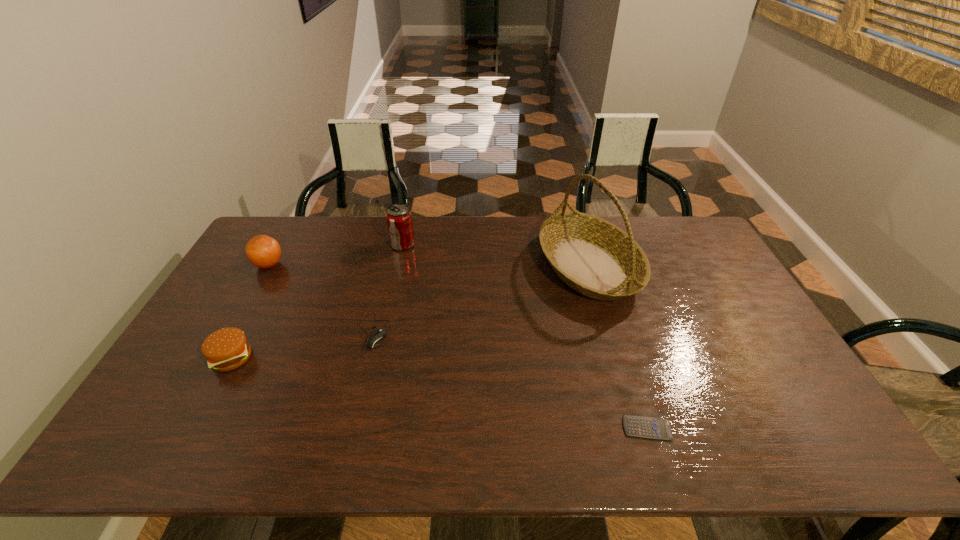
At what (x,y) coordinates should I click in order to perform the action: click on empty space that is in between the basket and the third tallest object. Please return your answer as a coordinate pair (x, y). The image size is (960, 540). Looking at the image, I should click on (428, 266).

You are a GUI agent. You are given a task and a screenshot of the screen. Output one action in this format:
    pyautogui.click(x=<x>, y=<y>)
    Task: Click on the unoccupied position between the pop soda and the orange
    The image size is (960, 540).
    Given the screenshot: What is the action you would take?
    pyautogui.click(x=336, y=255)

At what (x,y) coordinates should I click in order to perform the action: click on free space that is in between the calculator and the fourth shortest object. Please return your answer as a coordinate pair (x, y). Looking at the image, I should click on (458, 347).

The height and width of the screenshot is (540, 960). Find the location of `vacant area that lies between the shortest object and the third shortest object`. vacant area that lies between the shortest object and the third shortest object is located at coordinates (440, 393).

Where is `free space between the tallest object and the pop soda`? The image size is (960, 540). free space between the tallest object and the pop soda is located at coordinates (495, 255).

Locate an element on the screen. object that is the third closest one to the tallest object is located at coordinates (377, 335).

Identify the location of the fourth closest object relative to the tallest object. (226, 349).

The width and height of the screenshot is (960, 540). I want to click on free space that satisfies the following two spatial constraints: 1. on the back side of the fifth shortest object; 2. on the left side of the orange, so click(x=280, y=245).